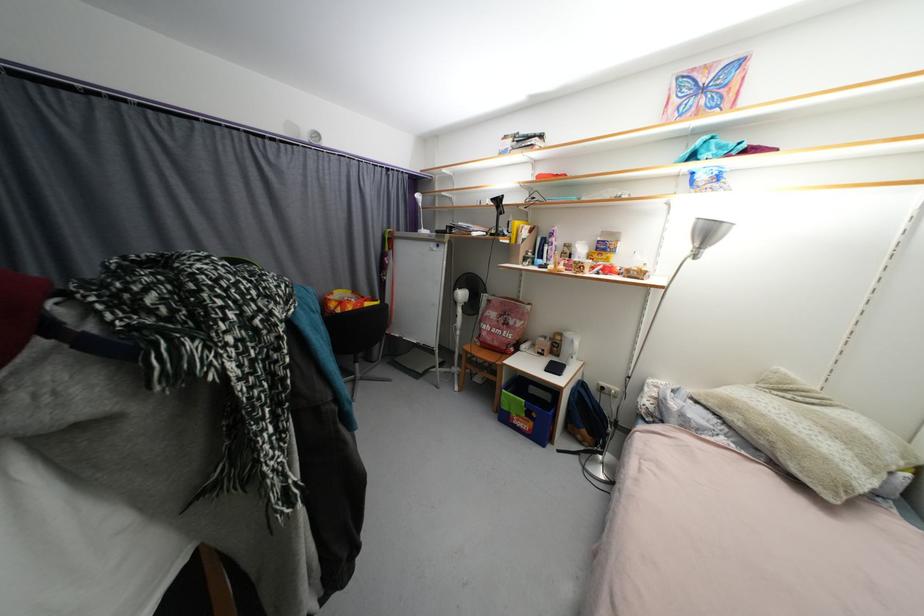
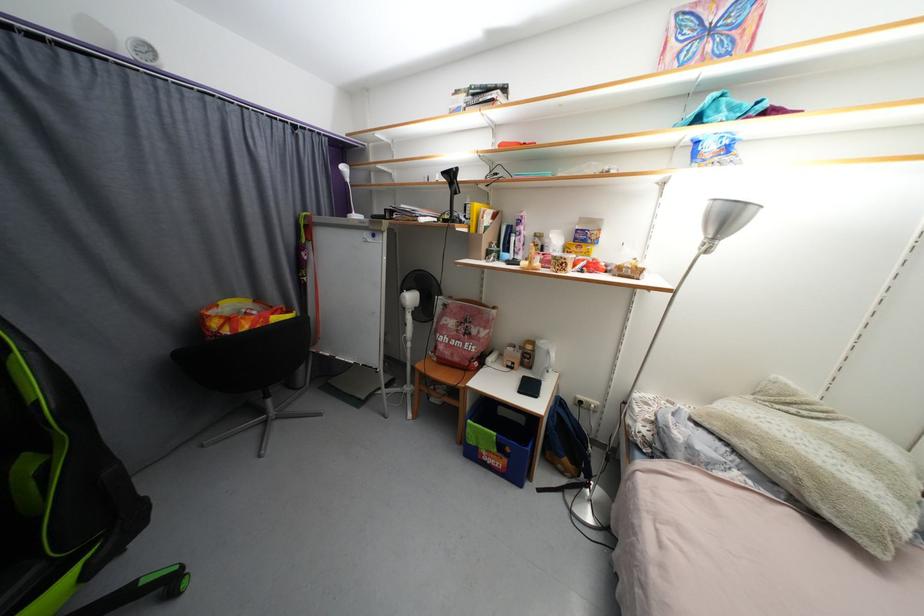
The point at (553, 339) is marked in the first image. Where is the corresponding point in the second image?

(523, 349)